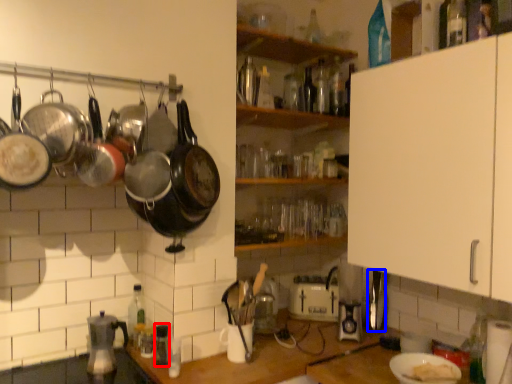
Question: Which object appears closest to the camera in this image, appliance (highlighted by a red box) or appliance (highlighted by a blue box)?

Choices:
 (A) appliance
 (B) appliance

Answer: (A)